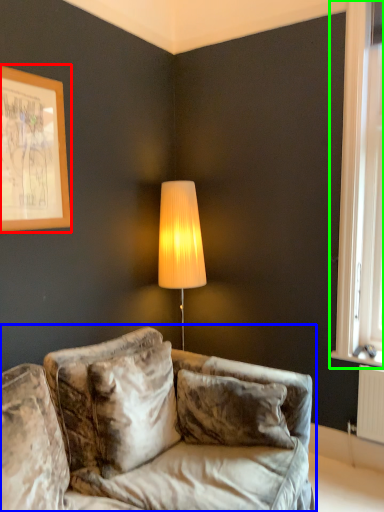
Question: Which object is positioned closest to picture frame (highlighted by a red box)? Select from studio couch (highlighted by a blue box) and window (highlighted by a green box).

Choices:
 (A) studio couch
 (B) window

Answer: (A)